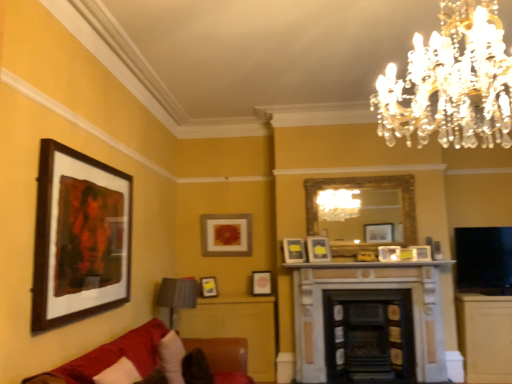
What are the coordinates of `free space above matte yellow picture frame at center, placed as the 2th picture frame when sorted from left to right (from a real-world perspective)` in the screenshot? It's located at (210, 268).